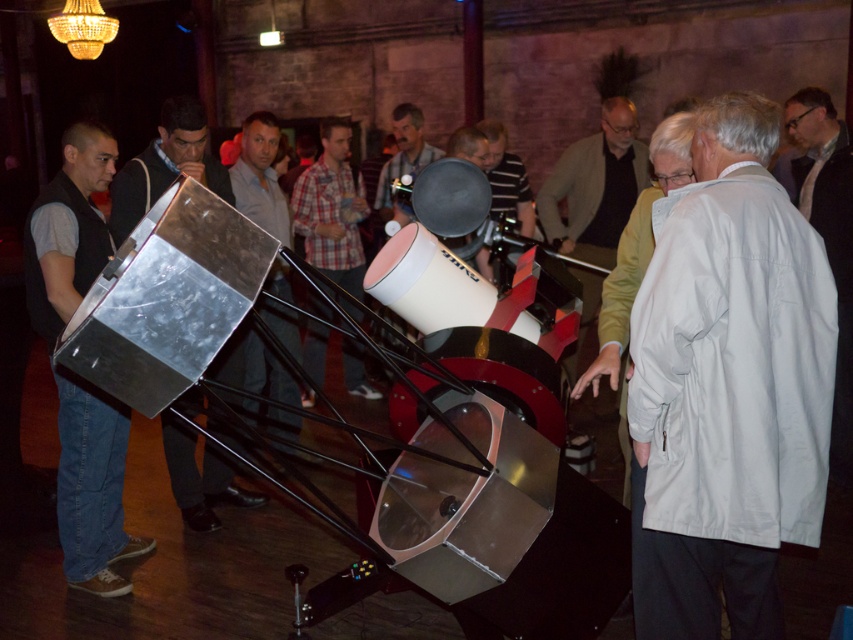
Question: Which point is farther from the camera taking this photo?

Choices:
 (A) (616, 131)
 (B) (497, 186)
 (C) (750, 196)
 (D) (816, 132)

Answer: (B)

Question: Among these objects, which one is nearest to the camera?

Choices:
 (A) light brown leather jacket at center
 (B) brushed metal telescope at center

Answer: (B)

Question: Can you confirm if light beige coat at center is positioned to the left of brushed metal telescope at center?

Choices:
 (A) yes
 (B) no

Answer: (B)

Question: Observing the image, what is the correct spatial positioning of light brown leather jacket at center in reference to white fabric coat at right?

Choices:
 (A) above
 (B) below

Answer: (B)

Question: Which point appears farthest from the camera in this image?

Choices:
 (A) (279, 323)
 (B) (567, 220)
 (C) (120, 193)

Answer: (B)

Question: Does metallic vest at left appear over striped cotton shirt at center?

Choices:
 (A) yes
 (B) no

Answer: (B)